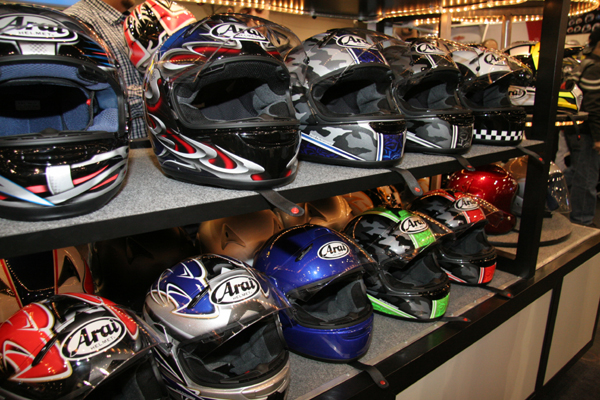
The image size is (600, 400). I want to click on floor, so (x=583, y=377).